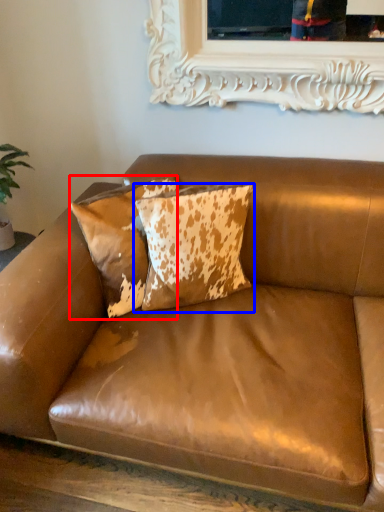
Question: Which object is further to the camera taking this photo, pillow (highlighted by a red box) or pillow (highlighted by a blue box)?

Choices:
 (A) pillow
 (B) pillow

Answer: (A)